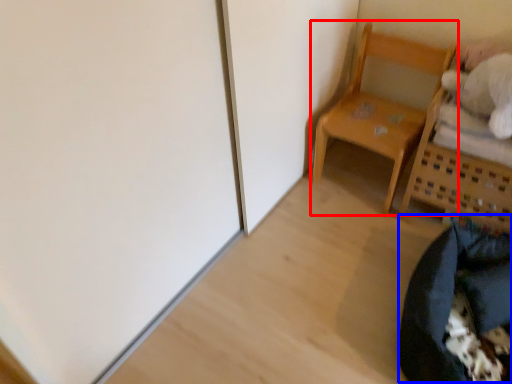
Question: Which object is closer to the camera taking this photo, furniture (highlighted by a red box) or bean bag chair (highlighted by a blue box)?

Choices:
 (A) furniture
 (B) bean bag chair

Answer: (B)